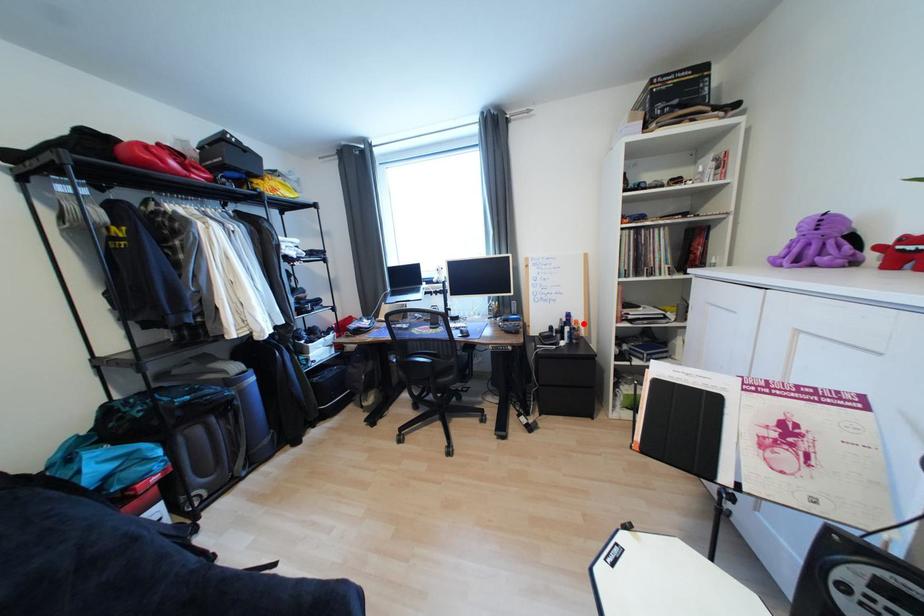
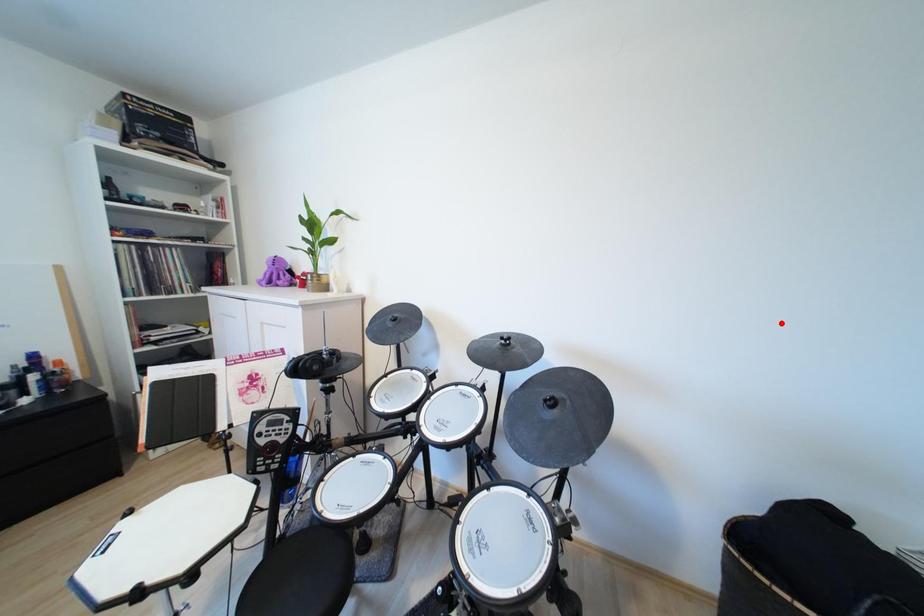
I am providing you with two images of the same scene from different viewpoints. A red point is marked on the first image and another point is marked on the second image. Do the highlighted points in image1 and image2 indicate the same real-world spot?

No